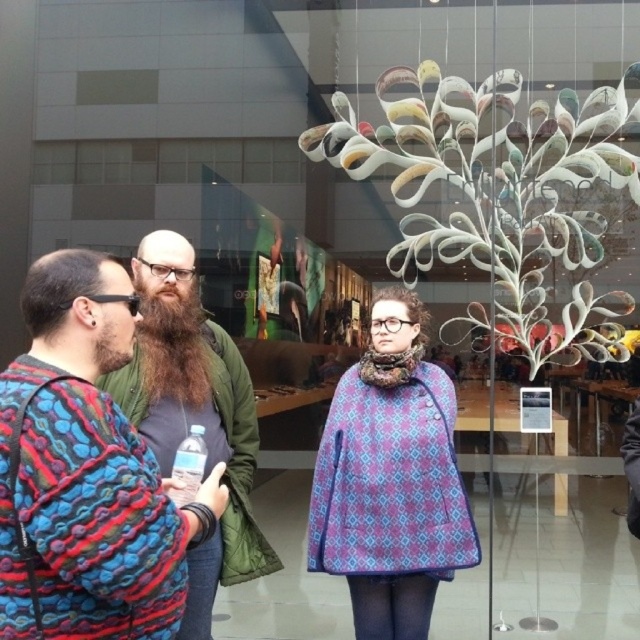
You are a photographer standing in front of the store. You want to take a photo of the green quilted jacket at center and the brownwoodybeard at center so that both are fully visible. Which object should you focus on to ensure the other is also in focus?

The green quilted jacket at center is much taller than the brownwoodybeard at center. Therefore, focusing on the green quilted jacket at center will ensure the brownwoodybeard at center is also in focus since it is closer to the camera.

In the scene shown: You are a photographer standing 10 feet away from the green quilted jacket at center and the brownwoodybeard at center. You want to take a photo that includes both subjects without any blur. Your camera has a minimum focus distance of 8 feet. Will you be able to capture both clearly?

The green quilted jacket at center and brownwoodybeard at center are 4.24 inches apart. Since you are 10 feet away from them, both subjects are within the camera minimum focus distance of 8 feet. Therefore, you can capture both clearly without blur.

You are standing at point (161, 317) and want to walk to the store entrance. There is a person at point (381, 436) blocking your path. Can you walk around them to reach the entrance?

Point (381, 436) is behind point (161, 317), so the person at point (381, 436) is not blocking your path. You can walk straight to the store entrance without any obstruction.